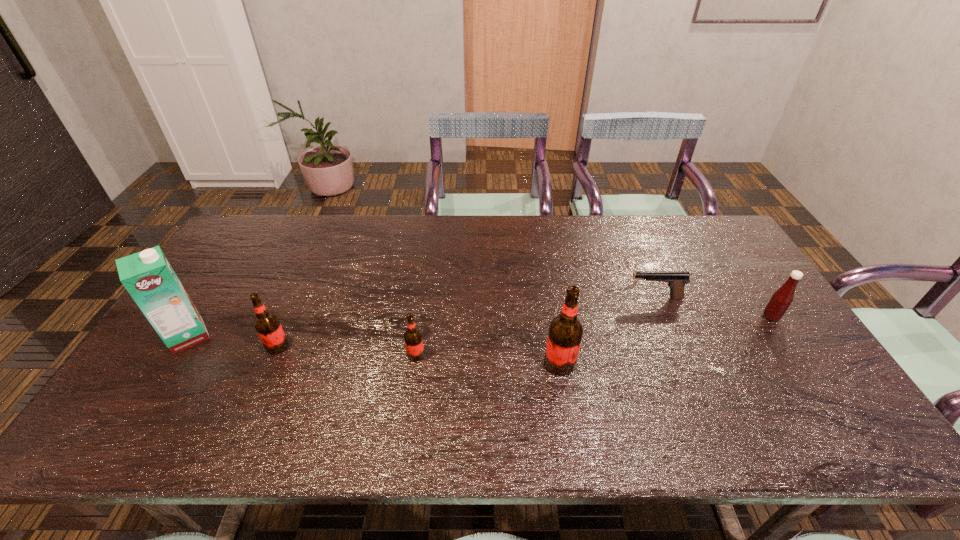
Locate an element on the screen. The image size is (960, 540). vacant space located on the right of the second tallest root beer is located at coordinates (396, 346).

Locate an element on the screen. The image size is (960, 540). free spot located 0.240m on the back of the shortest root beer is located at coordinates (425, 286).

Locate an element on the screen. blank space located 0.380m on the back of the rightmost root beer is located at coordinates (542, 259).

Where is `vacant space located on the left of the Tabasco sauce`? vacant space located on the left of the Tabasco sauce is located at coordinates (685, 317).

You are a GUI agent. You are given a task and a screenshot of the screen. Output one action in this format:
    pyautogui.click(x=<x>, y=<y>)
    Task: Click on the vacant space located at the muzzle of the fifth object from left to right
    
    Given the screenshot: What is the action you would take?
    pyautogui.click(x=516, y=298)

Image resolution: width=960 pixels, height=540 pixels. In order to click on vacant space located at the muzzle of the fifth object from left to right in this screenshot , I will do `click(492, 298)`.

This screenshot has height=540, width=960. I want to click on vacant space situated at the muzzle of the fifth object from left to right, so click(566, 298).

I want to click on vacant space located 0.360m on the back of the leftmost object, so click(x=249, y=241).

In order to click on object present at the near edge in this screenshot , I will do `click(565, 333)`.

Locate an element on the screen. This screenshot has height=540, width=960. object that is at the left edge is located at coordinates (149, 278).